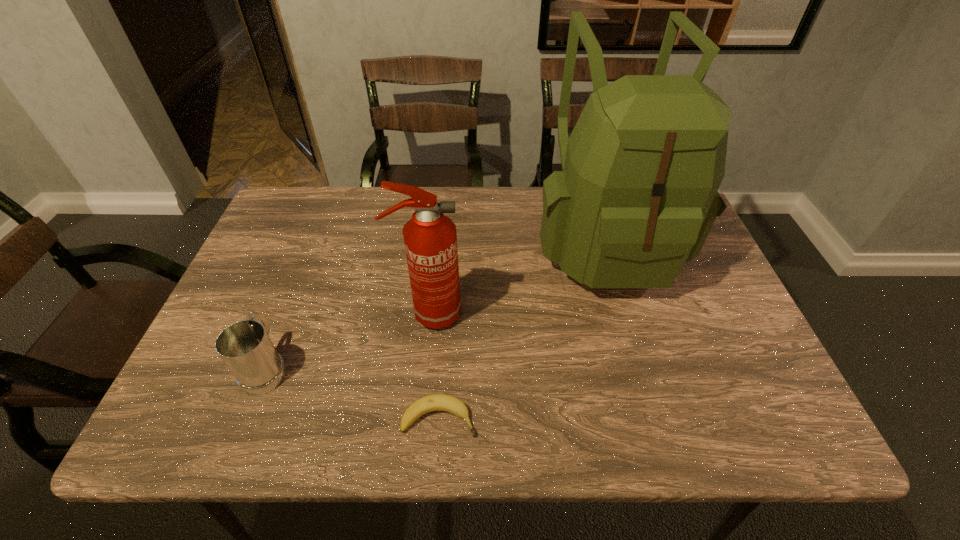
Where is `vacant space located 0.060m on the side of the second nearest object with the handle`? vacant space located 0.060m on the side of the second nearest object with the handle is located at coordinates (285, 320).

The width and height of the screenshot is (960, 540). Find the location of `free space located on the side of the second nearest object with the handle`. free space located on the side of the second nearest object with the handle is located at coordinates 293,301.

The height and width of the screenshot is (540, 960). I want to click on vacant space located 0.100m at the stem of the shortest object, so coord(528,418).

The image size is (960, 540). I want to click on object present at the far edge, so click(x=637, y=196).

Where is `object that is at the near edge`? The image size is (960, 540). object that is at the near edge is located at coordinates (436, 402).

Find the location of a particular element. object at the left edge is located at coordinates (245, 347).

Locate an element on the screen. The height and width of the screenshot is (540, 960). object present at the right edge is located at coordinates (637, 196).

Where is `object that is at the far right corner`? object that is at the far right corner is located at coordinates pyautogui.click(x=637, y=196).

This screenshot has height=540, width=960. In the image, there is a desktop. Identify the location of free space at the far edge. (540, 196).

Locate an element on the screen. vacant space at the near edge of the desktop is located at coordinates (528, 437).